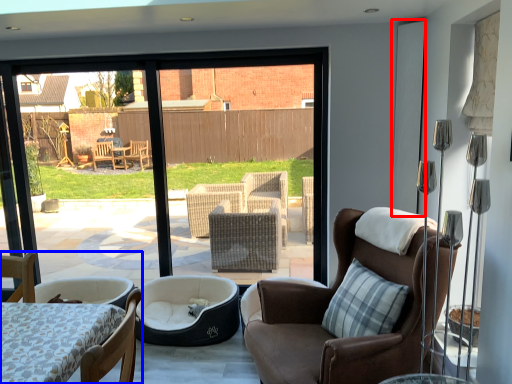
Question: Among these objects, which one is farthest to the camera, screen door (highlighted by a red box) or chair (highlighted by a blue box)?

Choices:
 (A) screen door
 (B) chair

Answer: (A)